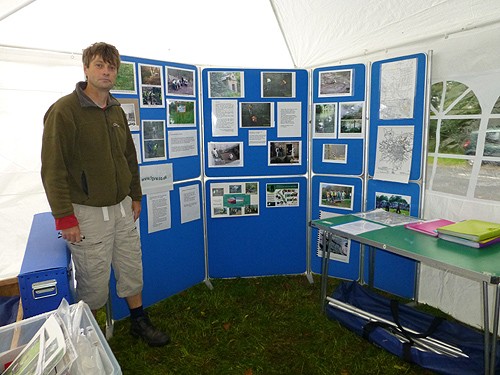
Identify the location of floor. This screenshot has height=375, width=500. (189, 367).